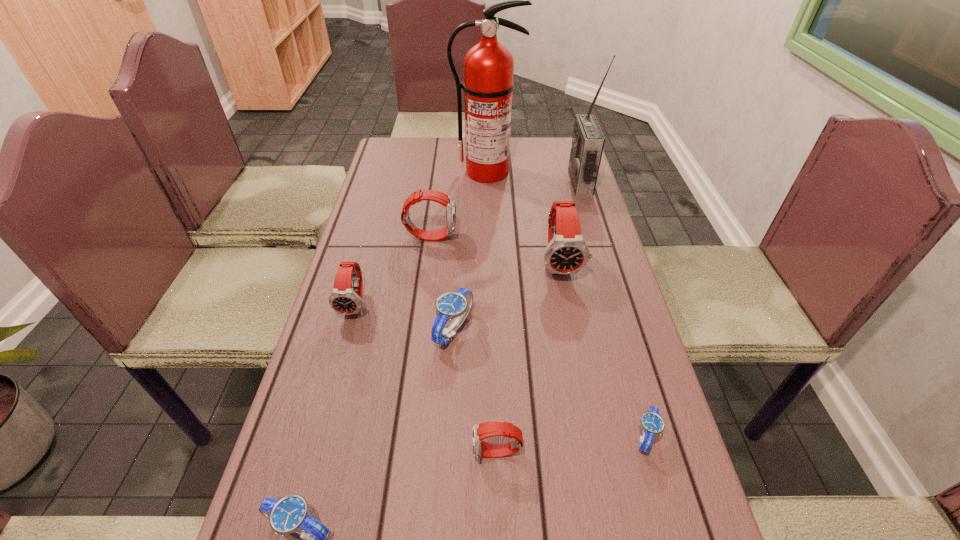
Where is `object that is at the far right corner`? This screenshot has height=540, width=960. object that is at the far right corner is located at coordinates (588, 140).

Find the location of a particular element. The width and height of the screenshot is (960, 540). vacant space at the far edge is located at coordinates (515, 168).

In the image, there is a desktop. In order to click on vacant space at the left edge in this screenshot , I will do `click(369, 233)`.

Locate an element on the screen. This screenshot has height=540, width=960. free space at the right edge is located at coordinates (606, 342).

Locate an element on the screen. vacant region at the far left corner of the desktop is located at coordinates (406, 168).

Locate an element on the screen. The width and height of the screenshot is (960, 540). free space at the far right corner is located at coordinates (562, 153).

Identify the location of free space between the third biggest red watch and the third watch from right to left. The image size is (960, 540). (426, 379).

Find the location of a particular element. Image resolution: width=960 pixels, height=540 pixels. vacant area that lies between the second tallest watch and the third tallest object is located at coordinates (495, 249).

This screenshot has width=960, height=540. I want to click on vacant space in between the third red watch from left to right and the radio receiver, so click(539, 318).

Find the location of `object that is the seventh closest one to the second nearest blue watch`. object that is the seventh closest one to the second nearest blue watch is located at coordinates (588, 140).